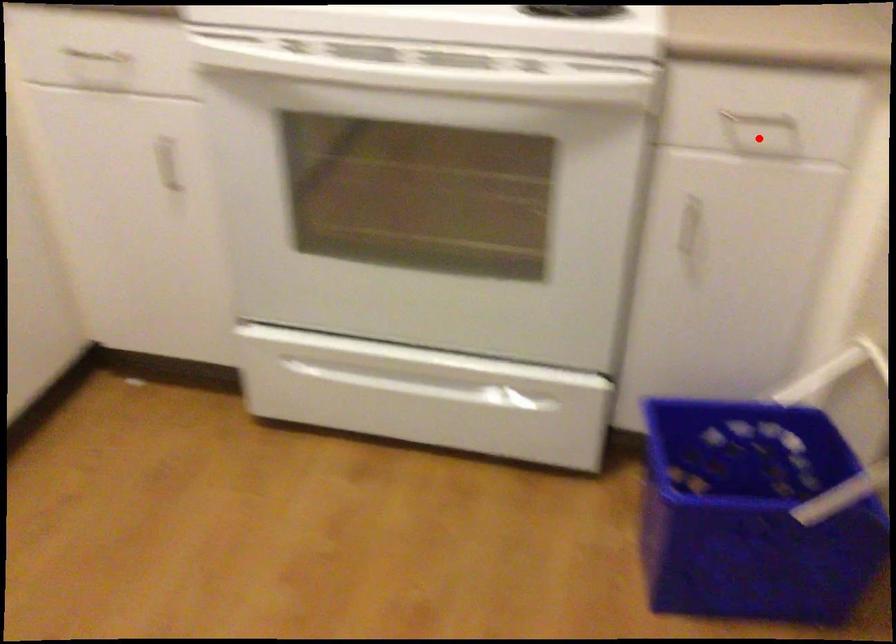
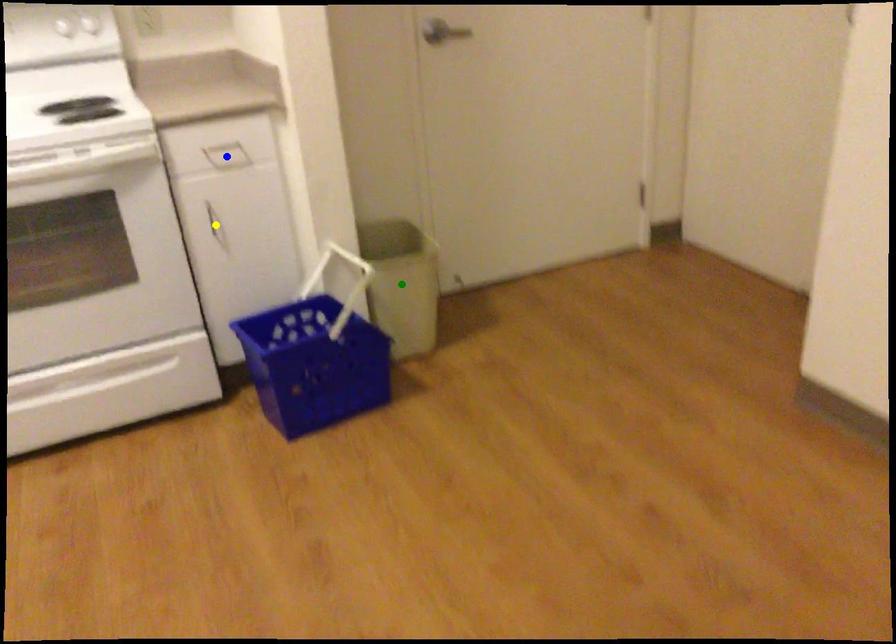
Question: I am providing you with two images of the same scene from different viewpoints. A red point is marked on the first image. You are given multiple points on the second image. Which point in image 2 represents the same 3d spot as the red point in image 1?

Choices:
 (A) green point
 (B) blue point
 (C) yellow point

Answer: (B)